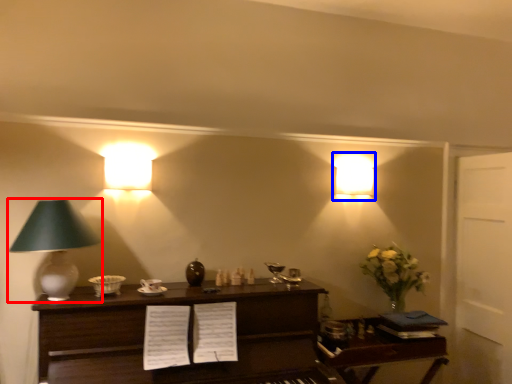
Question: Which point is closer to the camera, lamp (highlighted by a red box) or lamp (highlighted by a blue box)?

Choices:
 (A) lamp
 (B) lamp

Answer: (A)